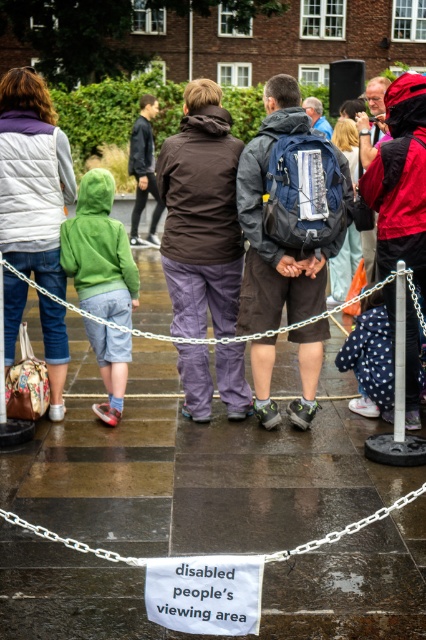
Is matte black backpack at center shorter than white paper sign at lower center?

Incorrect, matte black backpack at center's height does not fall short of white paper sign at lower center's.

Who is positioned more to the left, matte black backpack at center or white paper sign at lower center?

From the viewer's perspective, white paper sign at lower center appears more on the left side.

Locate an element on the screen. matte black backpack at center is located at coordinates (284, 216).

You are a GUI agent. You are given a task and a screenshot of the screen. Output one action in this format:
    pyautogui.click(x=<x>, y=<y>)
    Task: Click on the matte black backpack at center
    The height and width of the screenshot is (640, 426).
    Given the screenshot: What is the action you would take?
    pyautogui.click(x=284, y=216)

Does matte black backpack at center have a lesser height compared to brown fabric jacket at center?

In fact, matte black backpack at center may be taller than brown fabric jacket at center.

What do you see at coordinates (284, 216) in the screenshot?
I see `matte black backpack at center` at bounding box center [284, 216].

Identify the location of matte black backpack at center. (284, 216).

Between silver chain at center and white paper sign at lower center, which one has less height?

With less height is white paper sign at lower center.

Does silver chain at center have a lesser height compared to white paper sign at lower center?

No.

Between point (180, 340) and point (339, 532), which one is positioned in front?

Point (339, 532) is in front.

Image resolution: width=426 pixels, height=640 pixels. In order to click on silver chain at center in this screenshot , I will do `click(224, 336)`.